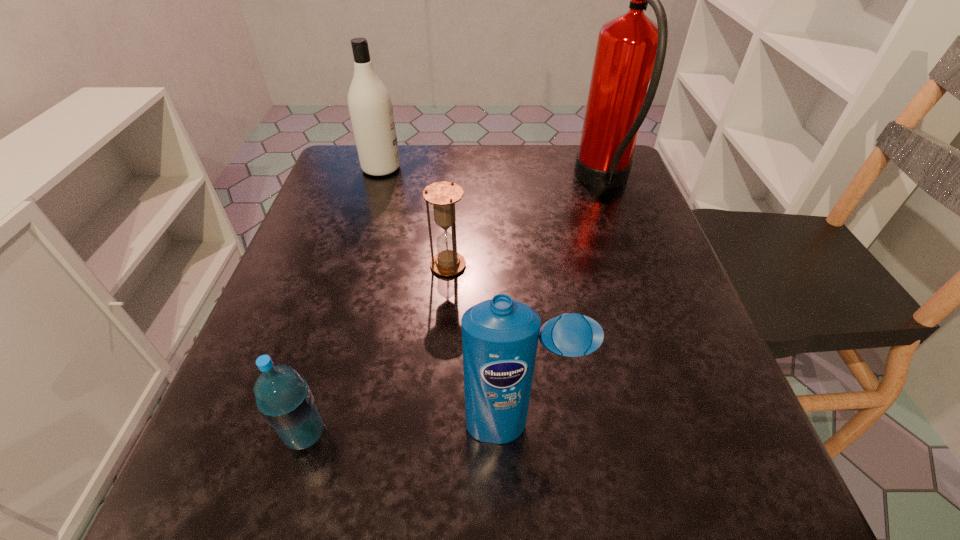
The image size is (960, 540). Identify the location of fire extinguisher. (630, 52).

Locate an element on the screen. Image resolution: width=960 pixels, height=540 pixels. the tallest object is located at coordinates (630, 52).

Identify the location of the left shampoo. Image resolution: width=960 pixels, height=540 pixels. (370, 106).

This screenshot has width=960, height=540. In order to click on the right shampoo in this screenshot , I will do `click(500, 336)`.

Where is `the nearer shampoo`? the nearer shampoo is located at coordinates (500, 336).

Where is `water bottle`? water bottle is located at coordinates (283, 397).

This screenshot has height=540, width=960. In order to click on the third object from right to left in this screenshot , I will do `click(443, 195)`.

The width and height of the screenshot is (960, 540). Identify the location of hourglass. (443, 195).

At what (x,y) coordinates should I click in order to perform the action: click on vacant space located on the left of the tallest object. Please return your answer as a coordinate pair (x, y). Looking at the image, I should click on (411, 181).

Where is `free region located on the front-facing side of the left shampoo`? The image size is (960, 540). free region located on the front-facing side of the left shampoo is located at coordinates (548, 168).